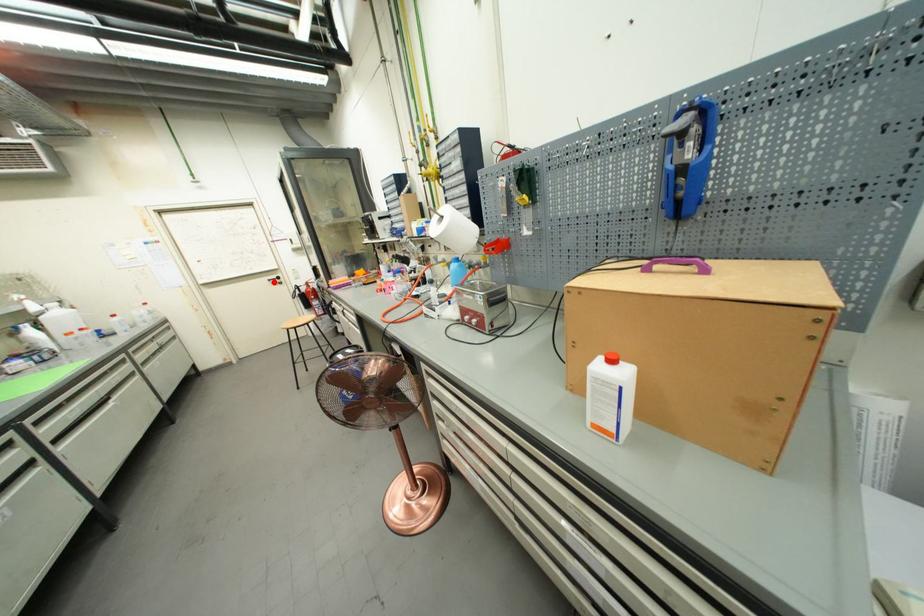
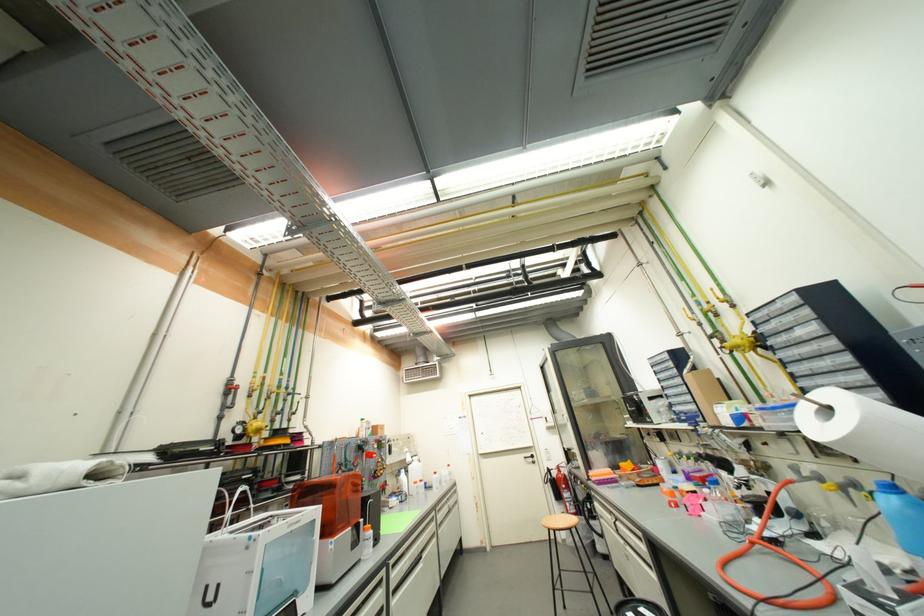
Question: I am providing you with two images of the same scene from different viewpoints. Image1 has a red point marked. In image2, the corresponding 3D location appears at what relative position? Reply with the corresponding letter.

Choices:
 (A) Closer
 (B) Farther

Answer: (B)